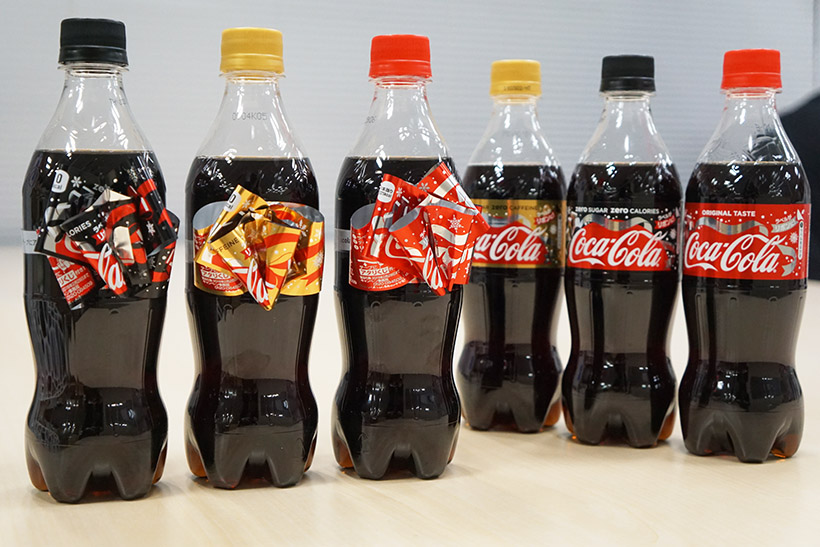
The width and height of the screenshot is (820, 547). In order to click on bottles in this screenshot , I will do `click(744, 290)`, `click(629, 309)`, `click(521, 309)`, `click(422, 316)`, `click(271, 331)`, `click(124, 342)`.